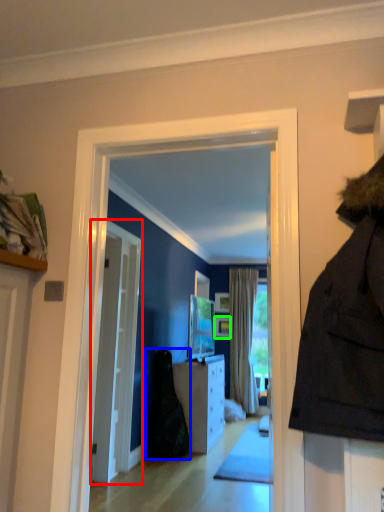
Question: Considering the real-world distances, which object is farthest from door (highlighted by a red box)? dark (highlighted by a blue box) or picture frame (highlighted by a green box)?

Choices:
 (A) dark
 (B) picture frame

Answer: (B)